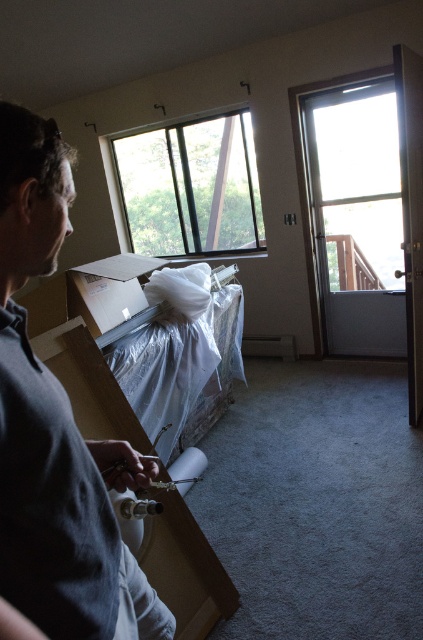
Does point (172, 173) come farther from viewer compared to point (107, 307)?

That is True.

Is clear glass window at upper center smaller than cardboard box at center?

Actually, clear glass window at upper center might be larger than cardboard box at center.

At what (x,y) coordinates should I click in order to perform the action: click on clear glass window at upper center. Please return your answer as a coordinate pair (x, y). This screenshot has width=423, height=640. Looking at the image, I should click on (191, 188).

Can you confirm if matte brown cardboard box at left is positioned above cardboard box at center?

No.

Between matte brown cardboard box at left and cardboard box at center, which one is positioned higher?

cardboard box at center is higher up.

Between point (109, 387) and point (68, 301), which one is positioned in front?

Point (109, 387) is more forward.

Image resolution: width=423 pixels, height=640 pixels. I want to click on matte brown cardboard box at left, so click(184, 568).

Between clear glass window at upper center and matte brown cardboard box at left, which one appears on the right side from the viewer's perspective?

From the viewer's perspective, matte brown cardboard box at left appears more on the right side.

Locate an element on the screen. clear glass window at upper center is located at coordinates pos(191,188).

Is point (164, 172) closer to viewer compared to point (206, 588)?

That is False.

You are a GUI agent. You are given a task and a screenshot of the screen. Output one action in this format:
    pyautogui.click(x=<x>, y=<y>)
    Task: Click on the clear glass window at upper center
    The height and width of the screenshot is (640, 423).
    Given the screenshot: What is the action you would take?
    pyautogui.click(x=191, y=188)